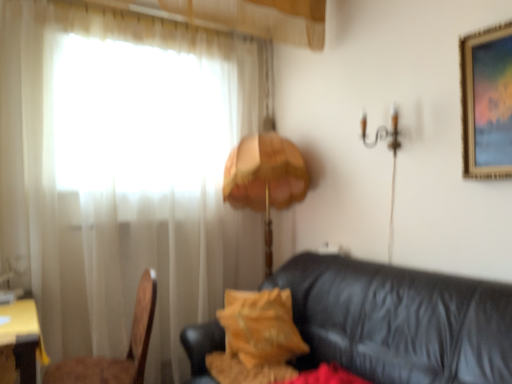
Question: Is white sheer curtain at left inside the boundaries of velvet yellow pillow at center, or outside?

Choices:
 (A) outside
 (B) inside

Answer: (A)

Question: Is white sheer curtain at left taller or shorter than velvet yellow pillow at center?

Choices:
 (A) tall
 (B) short

Answer: (A)

Question: Considering the real-world distances, which object is closest to the velvet yellow pillow at center?

Choices:
 (A) yellow wood table at lower left
 (B) white sheer curtain at left
 (C) orange fabric lampshade at center
 (D) wooden chair at left
 (E) black leather couch at lower right

Answer: (E)

Question: Estimate the real-world distances between objects in this image. Which object is closer to the black leather couch at lower right?

Choices:
 (A) wooden chair at left
 (B) white sheer curtain at left
 (C) yellow wood table at lower left
 (D) velvet yellow pillow at center
 (E) orange fabric lampshade at center

Answer: (D)